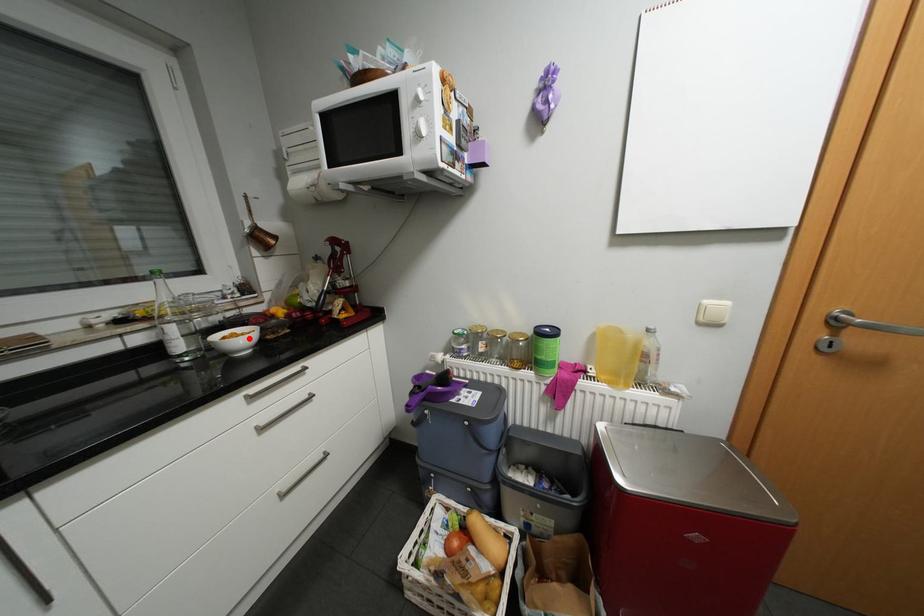
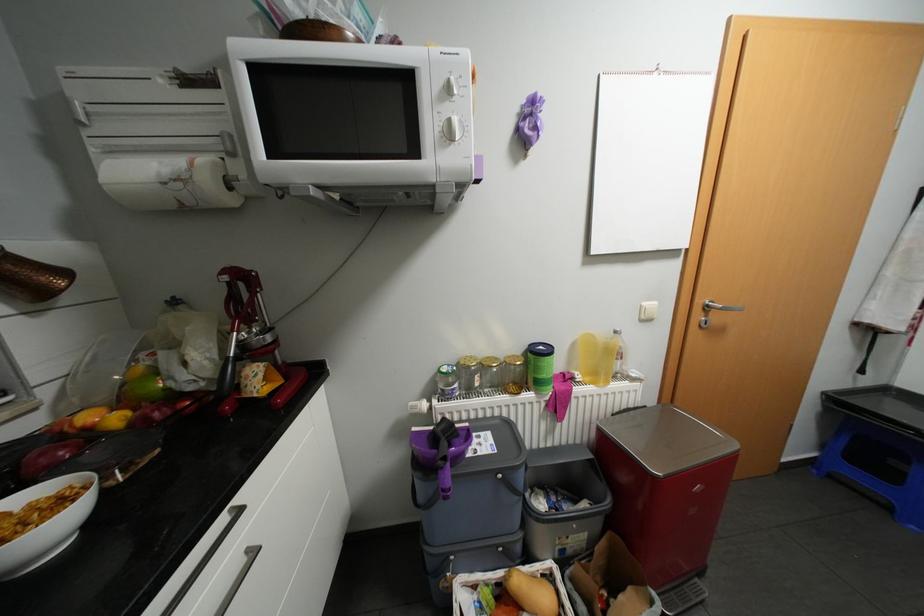
In the second image, find the point that corresponds to the highlighted location in the first image.

(44, 522)